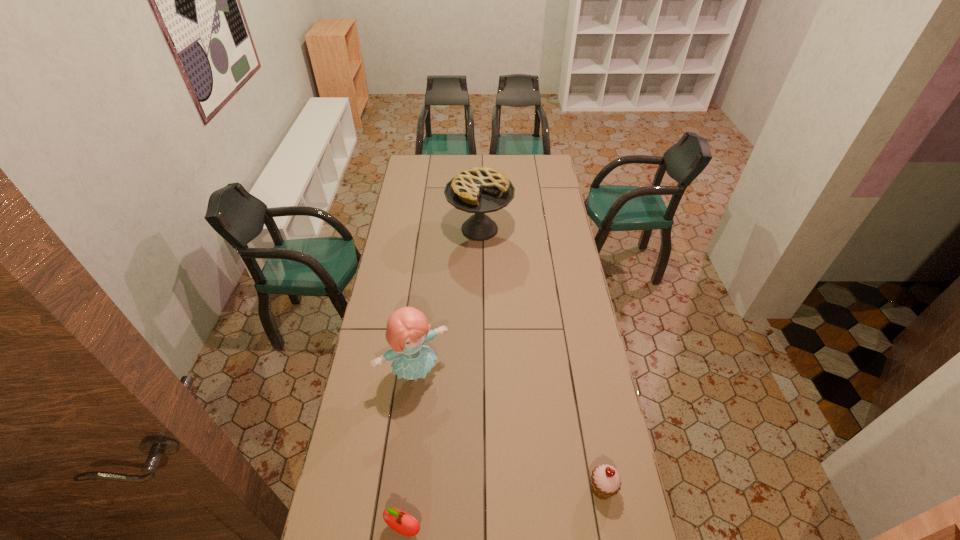
At what (x,y) coordinates should I click in order to perform the action: click on vacant area that lies between the cupcake and the doll. Please return your answer as a coordinate pair (x, y). The width and height of the screenshot is (960, 540). Looking at the image, I should click on (509, 430).

Locate an element on the screen. blank region between the farthest object and the third farthest object is located at coordinates (540, 359).

This screenshot has width=960, height=540. Identify the location of vacant space in between the doll and the third farthest object. (509, 430).

Find the location of `object that is the second closest to the nearest object`. object that is the second closest to the nearest object is located at coordinates (605, 480).

Locate which object ranks third in proximity to the doll. Please provide its 2D coordinates. Your answer should be formatted as a tuple, i.e. [(x, y)], where the tuple contains the x and y coordinates of a point satisfying the conditions above.

[(479, 190)]